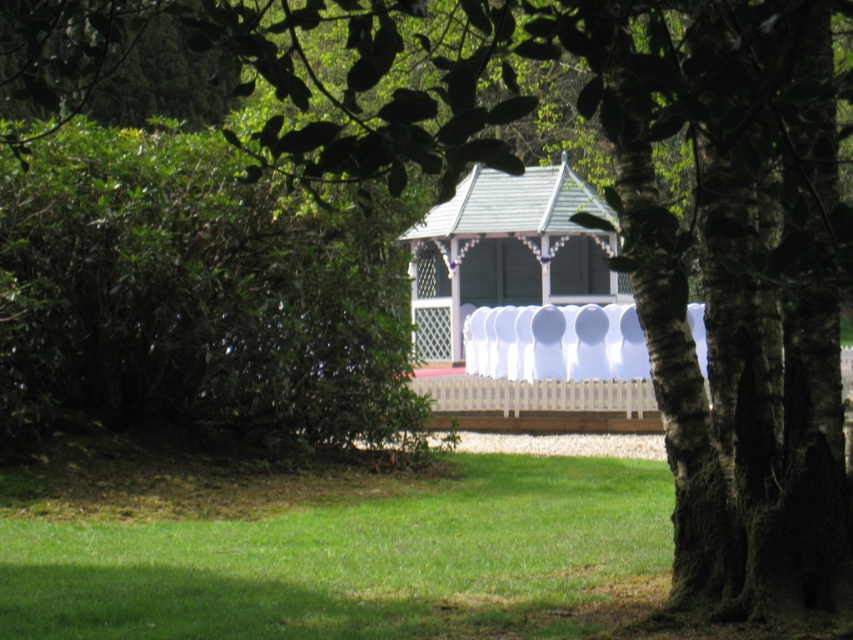
Question: Can you confirm if green grass at lower center is thinner than white wood gazebo at center?

Choices:
 (A) no
 (B) yes

Answer: (A)

Question: Which of the following is the farthest from the observer?

Choices:
 (A) (581, 268)
 (B) (357, 586)

Answer: (A)

Question: Which point is closer to the camera?

Choices:
 (A) (572, 552)
 (B) (535, 250)

Answer: (A)

Question: Observing the image, what is the correct spatial positioning of green grass at lower center in reference to white wood gazebo at center?

Choices:
 (A) right
 (B) left

Answer: (B)

Question: Which object appears closest to the camera in this image?

Choices:
 (A) white wood gazebo at center
 (B) green grass at lower center

Answer: (A)

Question: Is green grass at lower center below white wood gazebo at center?

Choices:
 (A) yes
 (B) no

Answer: (A)